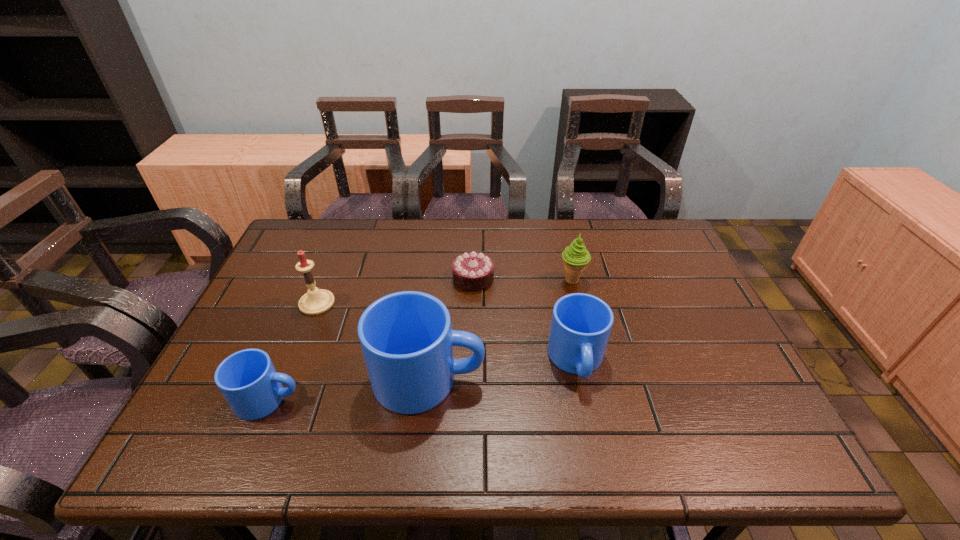
Given the evenly spaced mugs in the image, where should an extra mug be added on the right to preserve the spacing? Please point to a vacant space. Please provide its 2D coordinates. Your answer should be formatted as a tuple, i.e. [(x, y)], where the tuple contains the x and y coordinates of a point satisfying the conditions above.

[(714, 343)]